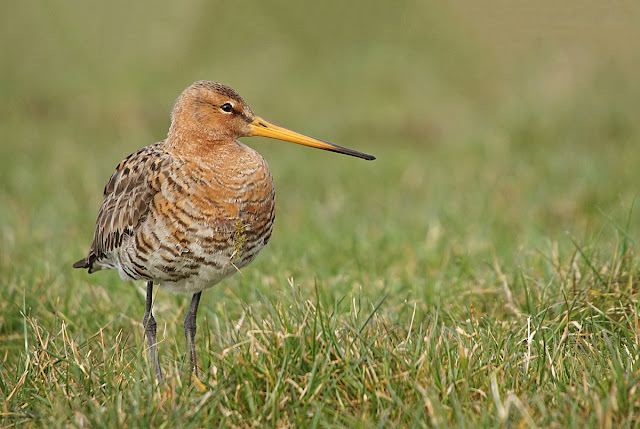
Where is `chest`? This screenshot has width=640, height=429. chest is located at coordinates (240, 176).